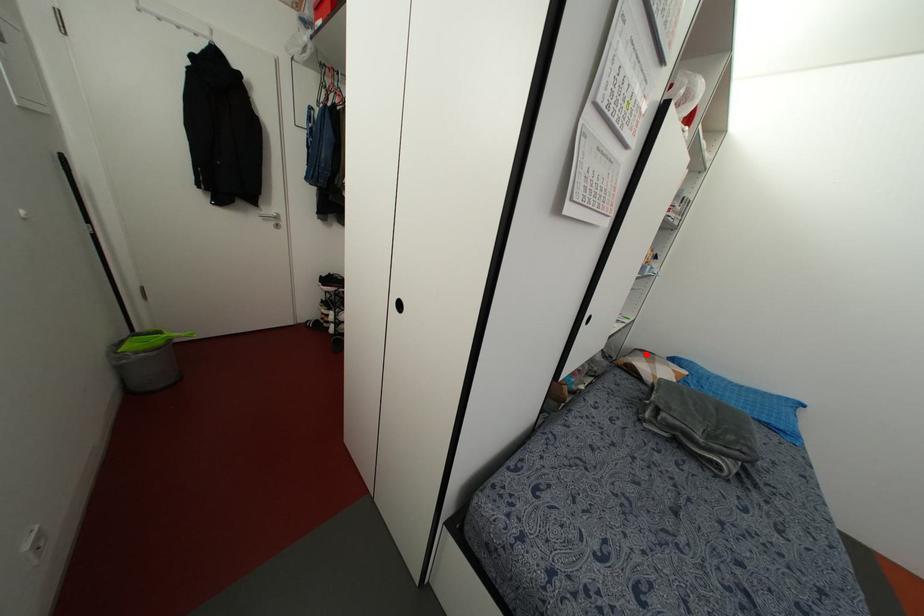
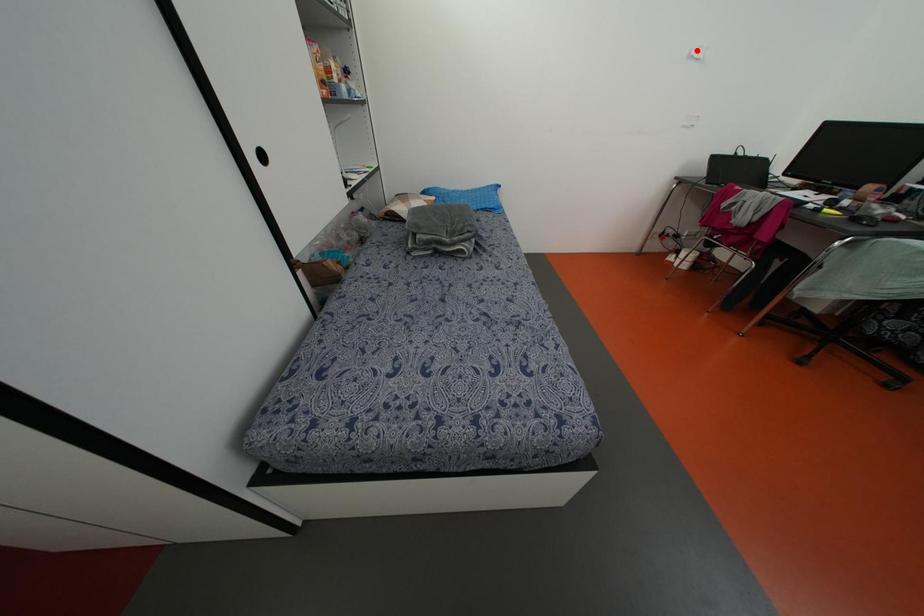
I am providing you with two images of the same scene from different viewpoints. A red point is marked on the first image and another point is marked on the second image. Does the point marked in image1 correspond to the same location as the one in image2?

No